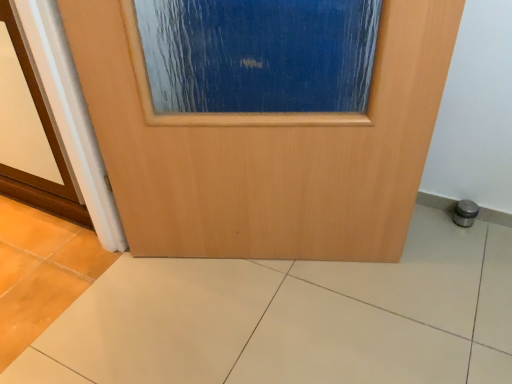
At what (x,y) coordinates should I click in order to perform the action: click on vacant space situated on the left part of wooden door at center. Please return your answer as a coordinate pair (x, y). The height and width of the screenshot is (384, 512). Looking at the image, I should click on (146, 311).